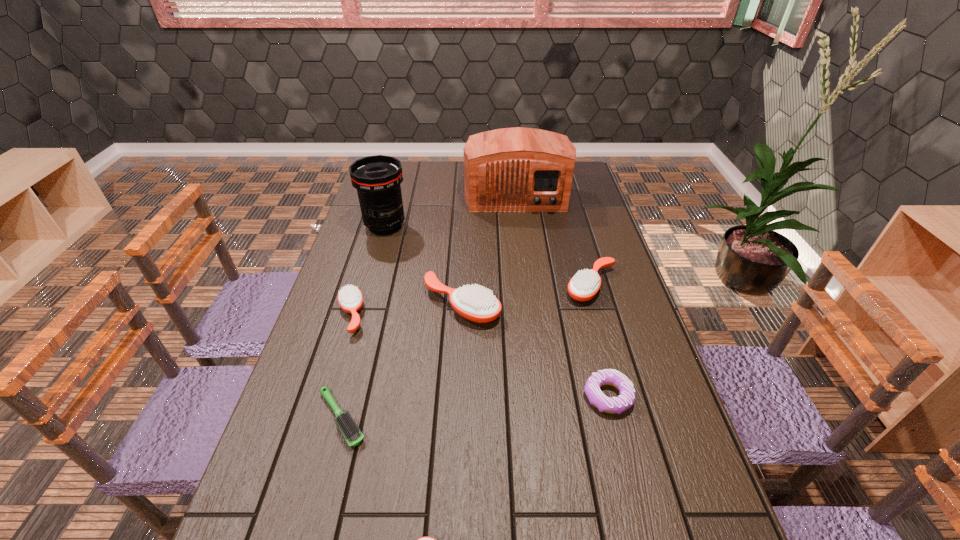
What are the coordinates of `radio receiver that is positioned at the right edge` in the screenshot? It's located at (518, 169).

What are the coordinates of `hairbrush at the right edge` in the screenshot? It's located at (585, 284).

Find the location of `doughnut located at the right edge`. doughnut located at the right edge is located at coordinates click(x=615, y=405).

I want to click on object present at the far right corner, so click(518, 169).

In the image, there is a desktop. Where is `vacant space at the left edge`? vacant space at the left edge is located at coordinates (331, 496).

In the image, there is a desktop. Where is `vacant space at the right edge`? Image resolution: width=960 pixels, height=540 pixels. vacant space at the right edge is located at coordinates (597, 226).

In the image, there is a desktop. Where is `free space at the far left corner`? Image resolution: width=960 pixels, height=540 pixels. free space at the far left corner is located at coordinates (409, 179).

Identify the location of empty space between the doughnut and the leftmost orange hairbrush. (479, 355).

Identify which object is located as the nearest to the rightmost hairbrush. Please provide its 2D coordinates. Your answer should be formatted as a tuple, i.e. [(x, y)], where the tuple contains the x and y coordinates of a point satisfying the conditions above.

[(473, 302)]

Locate an element on the screen. Image resolution: width=960 pixels, height=540 pixels. object that is the fifth closest to the shortest hairbrush is located at coordinates (585, 284).